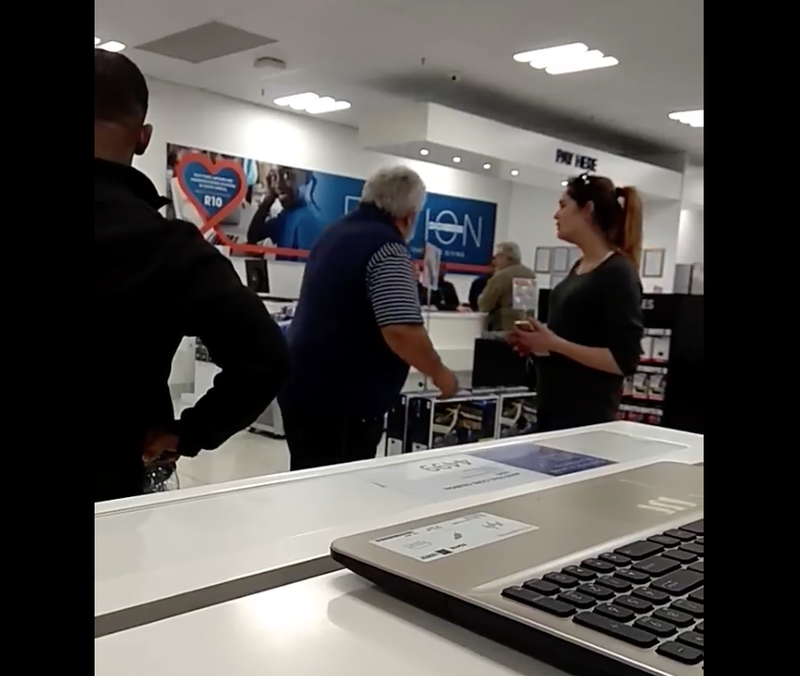
At what (x,y) coordinates should I click in order to perform the action: click on bench. Please return your answer as a coordinate pair (x, y). Looking at the image, I should click on (474, 418).